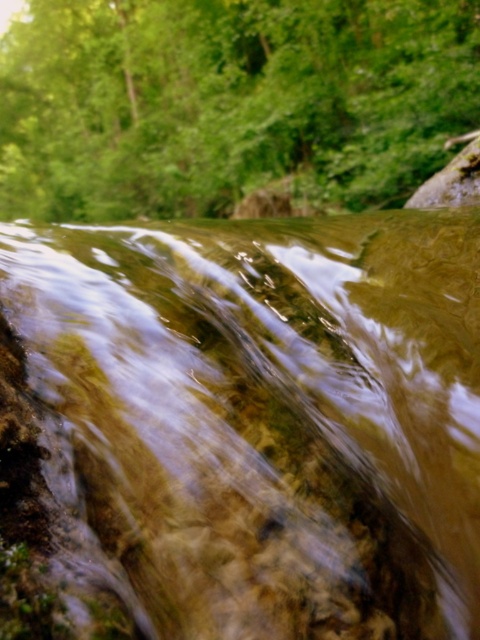
You are standing at the edge of the stream and see the point marked as point [240,428]. Based on the scene description, what is the nature of the water at that point?

The clear water at center is represented by point [240,428], so the water at that point is clear.

You are a hiker trying to cross the stream in the image. You notice the clear water at center and the green leafy tree at upper center. Which of these two objects is larger in size?

The green leafy tree at upper center is larger than the clear water at center.